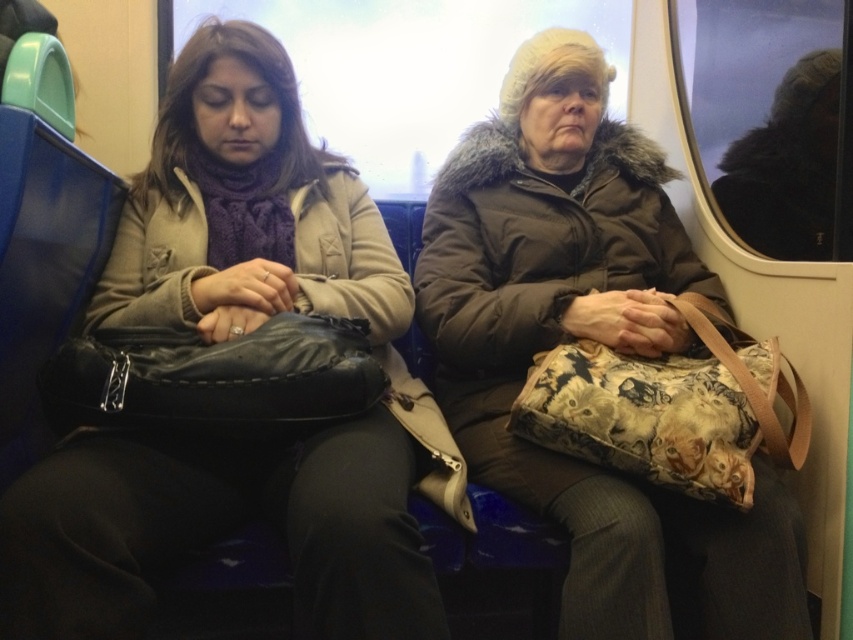
Question: Which of the following is the farthest from the observer?

Choices:
 (A) brown fuzzy coat at center
 (B) matte black bag at left

Answer: (A)

Question: Considering the relative positions of matte black bag at left and brown fuzzy coat at center in the image provided, where is matte black bag at left located with respect to brown fuzzy coat at center?

Choices:
 (A) left
 (B) right

Answer: (A)

Question: Can you confirm if matte black bag at left is positioned to the right of brown fuzzy coat at center?

Choices:
 (A) yes
 (B) no

Answer: (B)

Question: Which of the following is the farthest from the observer?

Choices:
 (A) (102, 483)
 (B) (610, 308)

Answer: (B)

Question: From the image, what is the correct spatial relationship of matte black bag at left in relation to brown fuzzy coat at center?

Choices:
 (A) left
 (B) right

Answer: (A)